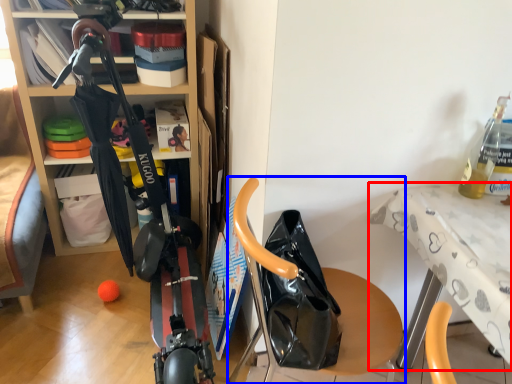
Question: Which point is further to the camera, table (highlighted by a red box) or furniture (highlighted by a blue box)?

Choices:
 (A) table
 (B) furniture

Answer: (A)